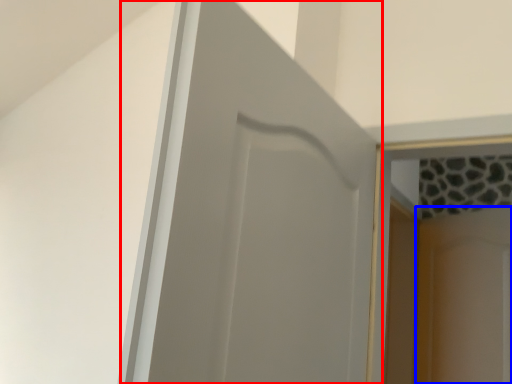
Question: Among these objects, which one is farthest to the camera, door (highlighted by a red box) or screen door (highlighted by a blue box)?

Choices:
 (A) door
 (B) screen door

Answer: (B)